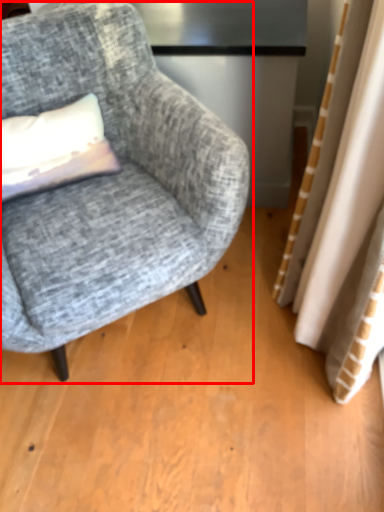
Question: From the image's perspective, where is chair (annotated by the red box) located in relation to pillow in the image?

Choices:
 (A) below
 (B) above

Answer: (A)